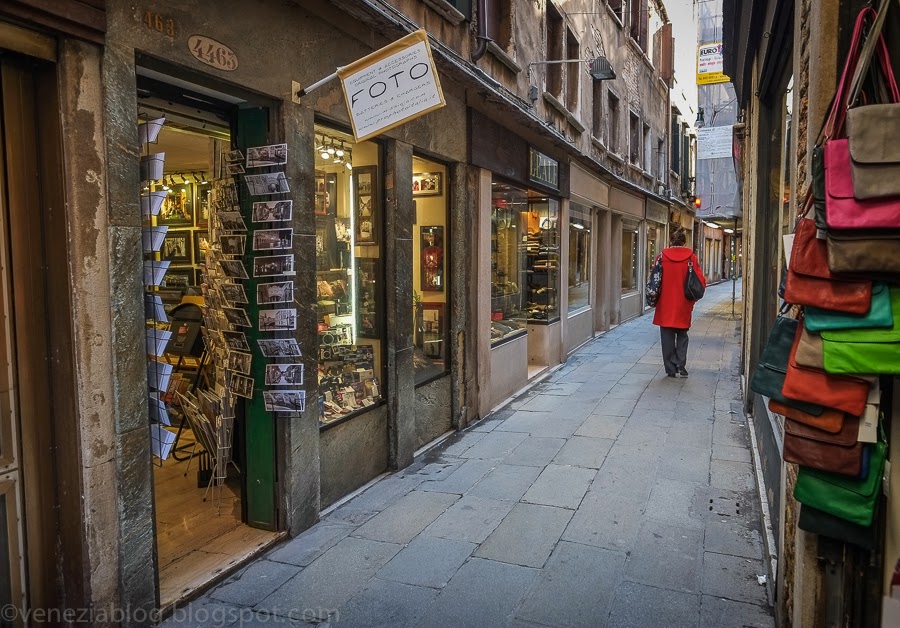
Image resolution: width=900 pixels, height=628 pixels. What are the coordinates of `coat` in the screenshot? It's located at 679,296.